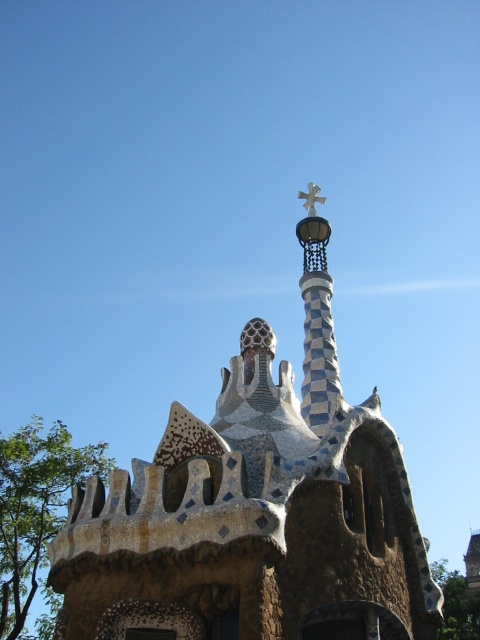
Question: Based on their relative distances, which object is nearer to the checkerboard mosaic spire at center?

Choices:
 (A) mosaic tile church at center
 (B) gold metallic cross at upper center

Answer: (A)

Question: In this image, where is checkerboard mosaic spire at center located relative to gold metallic cross at upper center?

Choices:
 (A) below
 (B) above

Answer: (A)

Question: Which of the following is the closest to the observer?

Choices:
 (A) (321, 196)
 (B) (302, 387)
 (C) (236, 534)

Answer: (C)

Question: Estimate the real-world distances between objects in this image. Which object is closer to the checkerboard mosaic spire at center?

Choices:
 (A) mosaic tile church at center
 (B) gold metallic cross at upper center

Answer: (A)

Question: Does mosaic tile church at center have a greater width compared to gold metallic cross at upper center?

Choices:
 (A) no
 (B) yes

Answer: (B)

Question: Is mosaic tile church at center wider than checkerboard mosaic spire at center?

Choices:
 (A) yes
 (B) no

Answer: (A)